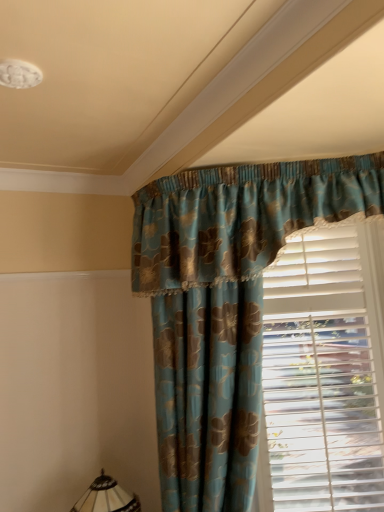
Question: Is blue floral fabric curtain at center bigger than translucent glass lampshade at lower left?

Choices:
 (A) no
 (B) yes

Answer: (B)

Question: Is there a large distance between blue floral fabric curtain at center and translucent glass lampshade at lower left?

Choices:
 (A) no
 (B) yes

Answer: (A)

Question: Does blue floral fabric curtain at center have a lesser width compared to translucent glass lampshade at lower left?

Choices:
 (A) no
 (B) yes

Answer: (A)

Question: Is blue floral fabric curtain at center positioned beyond the bounds of translucent glass lampshade at lower left?

Choices:
 (A) yes
 (B) no

Answer: (A)

Question: From a real-world perspective, is blue floral fabric curtain at center over translucent glass lampshade at lower left?

Choices:
 (A) no
 (B) yes

Answer: (B)

Question: Which is correct: blue floral fabric curtain at center is inside translucent glass lampshade at lower left, or outside of it?

Choices:
 (A) outside
 (B) inside

Answer: (A)

Question: From the image's perspective, is blue floral fabric curtain at center located above or below translucent glass lampshade at lower left?

Choices:
 (A) below
 (B) above

Answer: (B)

Question: Is blue floral fabric curtain at center bigger or smaller than translucent glass lampshade at lower left?

Choices:
 (A) small
 (B) big

Answer: (B)

Question: Is blue floral fabric curtain at center wider or thinner than translucent glass lampshade at lower left?

Choices:
 (A) wide
 (B) thin

Answer: (A)

Question: Is point (109, 478) positioned closer to the camera than point (244, 356)?

Choices:
 (A) farther
 (B) closer

Answer: (A)

Question: Considering the positions of translucent glass lampshade at lower left and blue floral fabric curtain at center in the image, is translucent glass lampshade at lower left wider or thinner than blue floral fabric curtain at center?

Choices:
 (A) thin
 (B) wide

Answer: (A)

Question: Would you say translucent glass lampshade at lower left is to the left or to the right of blue floral fabric curtain at center in the picture?

Choices:
 (A) left
 (B) right

Answer: (A)

Question: Considering the positions of translucent glass lampshade at lower left and blue floral fabric curtain at center in the image, is translucent glass lampshade at lower left taller or shorter than blue floral fabric curtain at center?

Choices:
 (A) short
 (B) tall

Answer: (A)

Question: From a real-world perspective, is translucent glass lampshade at lower left positioned above or below white plastic blinds at right?

Choices:
 (A) above
 (B) below

Answer: (B)

Question: Looking at their shapes, would you say translucent glass lampshade at lower left is wider or thinner than white plastic blinds at right?

Choices:
 (A) wide
 (B) thin

Answer: (A)